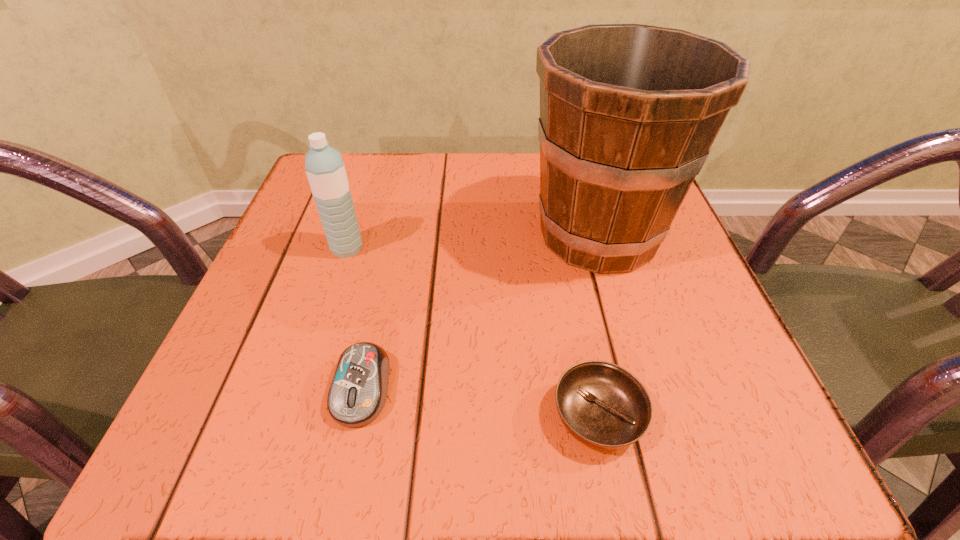
The width and height of the screenshot is (960, 540). Identify the location of soup bowl that is positioned at the near edge. (602, 405).

Locate an element on the screen. Image resolution: width=960 pixels, height=540 pixels. object positioned at the left edge is located at coordinates (324, 165).

Image resolution: width=960 pixels, height=540 pixels. I want to click on bucket that is at the right edge, so click(628, 112).

This screenshot has height=540, width=960. What are the coordinates of `soup bowl positioned at the right edge` in the screenshot? It's located at (602, 405).

The width and height of the screenshot is (960, 540). I want to click on object located in the far right corner section of the desktop, so click(628, 112).

You are a GUI agent. You are given a task and a screenshot of the screen. Output one action in this format:
    pyautogui.click(x=<x>, y=<y>)
    Task: Click on the object present at the near right corner
    This screenshot has width=960, height=540.
    Given the screenshot: What is the action you would take?
    pyautogui.click(x=602, y=405)

I want to click on vacant region at the far edge of the desktop, so click(x=491, y=160).

Image resolution: width=960 pixels, height=540 pixels. What are the coordinates of `free space at the near edge` in the screenshot? It's located at (499, 445).

The width and height of the screenshot is (960, 540). In the image, there is a desktop. Find the location of `free region at the left edge`. free region at the left edge is located at coordinates (300, 384).

At what (x,y) coordinates should I click in order to perform the action: click on free space at the right edge of the desktop. Please return your answer as a coordinate pair (x, y). Image resolution: width=960 pixels, height=540 pixels. Looking at the image, I should click on (681, 327).